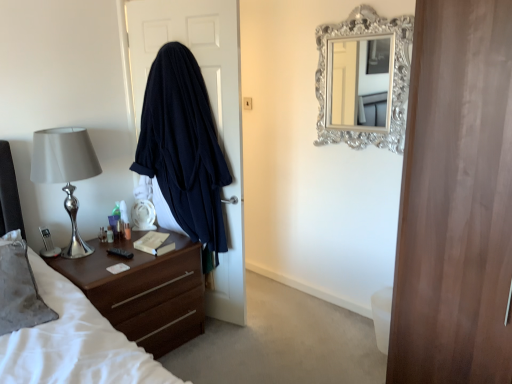
Question: Is dark blue fabric at left inside translucent plastic bottle at bedside, the third bottle positioned from the left?

Choices:
 (A) no
 (B) yes

Answer: (A)

Question: Considering the relative sizes of translucent plastic bottle at bedside, the third bottle positioned from the left, and dark blue fabric at left in the image provided, is translucent plastic bottle at bedside, the third bottle positioned from the left, wider than dark blue fabric at left?

Choices:
 (A) yes
 (B) no

Answer: (B)

Question: Is dark blue fabric at left at the back of translucent plastic bottle at bedside, the third bottle positioned from the left?

Choices:
 (A) no
 (B) yes

Answer: (A)

Question: Does translucent plastic bottle at bedside, the third bottle positioned from the left, appear on the left side of dark blue fabric at left?

Choices:
 (A) yes
 (B) no

Answer: (A)

Question: Is the depth of translucent plastic bottle at bedside, which is the 1th bottle from right to left, greater than that of dark blue fabric at left?

Choices:
 (A) no
 (B) yes

Answer: (B)

Question: Could you tell me if translucent plastic bottle at bedside, the third bottle positioned from the left, is turned towards dark blue fabric at left?

Choices:
 (A) yes
 (B) no

Answer: (B)

Question: Does hardcover book at center have a greater height compared to dark blue fabric at left?

Choices:
 (A) yes
 (B) no

Answer: (B)

Question: Is dark blue fabric at left surrounded by hardcover book at center?

Choices:
 (A) no
 (B) yes

Answer: (A)

Question: Does hardcover book at center have a smaller size compared to dark blue fabric at left?

Choices:
 (A) yes
 (B) no

Answer: (A)

Question: Can you confirm if hardcover book at center is positioned to the right of dark blue fabric at left?

Choices:
 (A) no
 (B) yes

Answer: (A)

Question: Does hardcover book at center lie behind dark blue fabric at left?

Choices:
 (A) no
 (B) yes

Answer: (B)

Question: From a real-world perspective, is hardcover book at center over dark blue fabric at left?

Choices:
 (A) no
 (B) yes

Answer: (A)

Question: From a real-world perspective, is black plastic remote control at left located beneath translucent plastic bottle at left, which appears as the 2th bottle when viewed from the left?

Choices:
 (A) no
 (B) yes

Answer: (B)